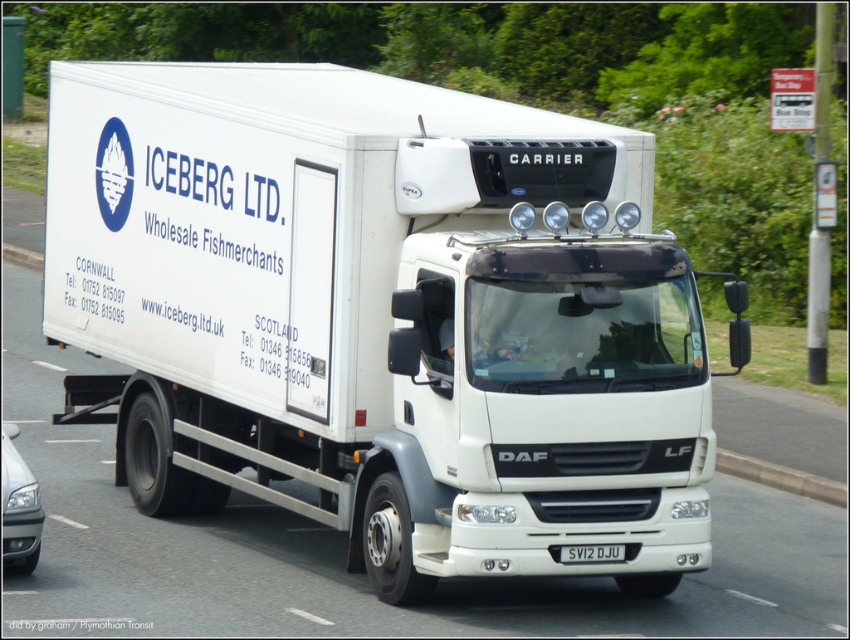
You are standing on the side of the road and see the white matte truck at center. If the truck is 39.47 feet away from you, and you have a camera with a 50mm lens, can you estimate how large the truck will appear in your photo? Assume the camera sensor size is 36mm x 24mm and the truck is 12 feet wide. Use the formula for angular field of view to calculate the width of the truck in millimeters on the sensor.

The white matte truck at center is 39.47 feet away. Using the formula for angular field of view, the width on the sensor would be approximately 24mm. Since the sensor width is 36mm, the truck would occupy about 24mm of the sensor horizontally, which is within the frame.

You need to attach a new GPS tracker to the white matte truck at center. The GPS tracker is the size of the black plastic license plate at center. Will the GPS tracker fit on the truck?

The white matte truck at center has a larger size compared to the black plastic license plate at center. Since the truck is bigger, the GPS tracker, which is the size of the license plate, will fit on the truck.

You are a delivery driver who needs to locate the white matte truck at center on a map. What are the coordinates where you can find it?

The white matte truck at center can be found at coordinates point (x=382, y=316).